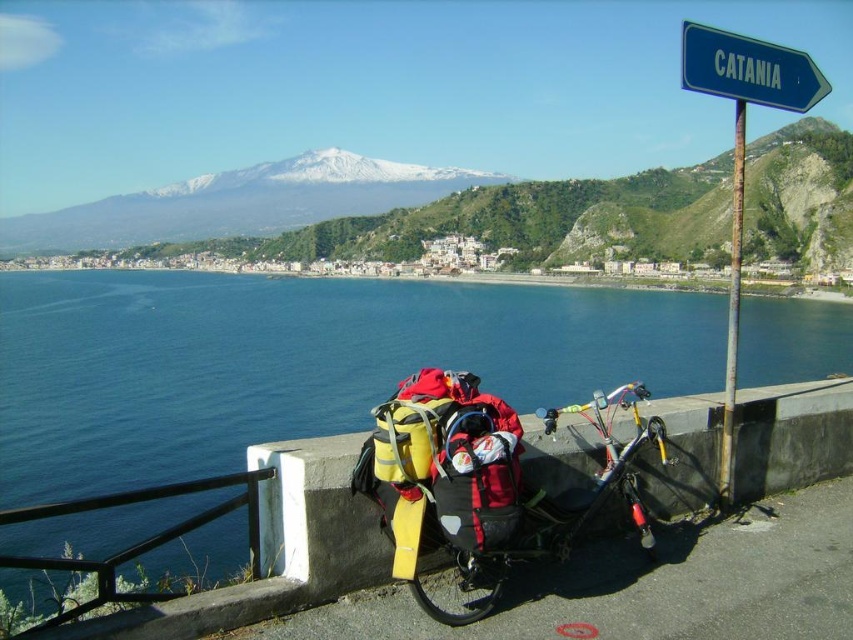
You are a cyclist who just arrived at this scenic coastal spot. You need to decide whether to place your backpack on the yellow fabric bicycle at lower center or hang it on the blue plastic signpost at upper right. Which object can hold a larger backpack?

The yellow fabric bicycle at lower center is larger in size than the blue plastic signpost at upper right, so it can hold a larger backpack.

You are a cyclist who just arrived at this scenic coastal spot. You need to decide whether to place your water bottle on the yellow fabric bicycle at lower center or the blue plastic signpost at upper right. Based on their positions, which one is more accessible for you to reach without moving from your current position?

The yellow fabric bicycle at lower center is closer to the viewer than the blue plastic signpost at upper right, so it is more accessible to reach without moving.